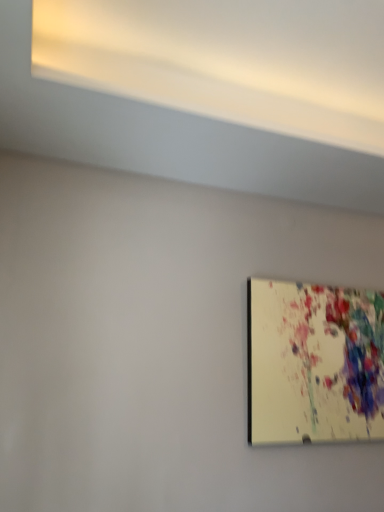
What do you see at coordinates (314, 362) in the screenshot? The height and width of the screenshot is (512, 384). I see `white matte canvas at lower right` at bounding box center [314, 362].

Where is `white matte canvas at lower right`? white matte canvas at lower right is located at coordinates (314, 362).

The height and width of the screenshot is (512, 384). In order to click on white matte canvas at lower right in this screenshot , I will do `click(314, 362)`.